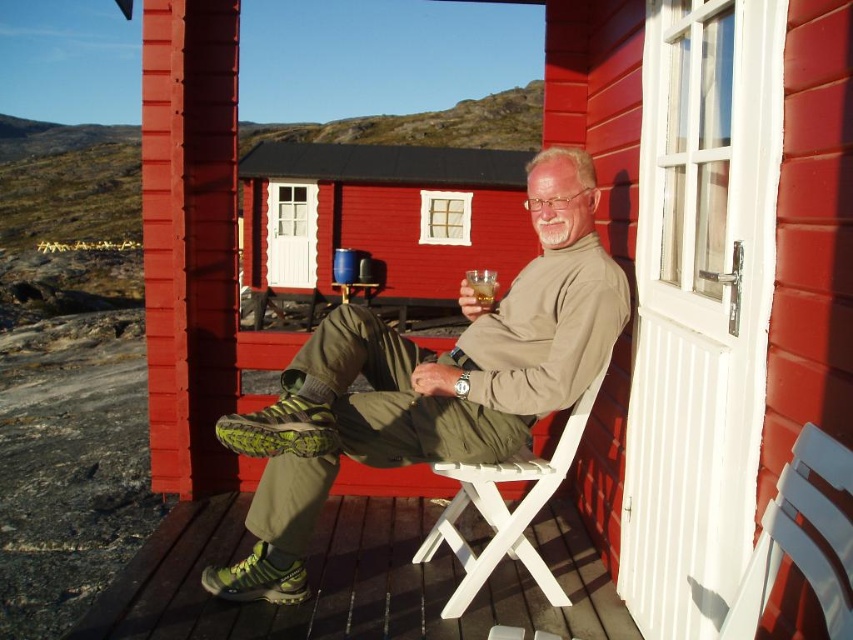
You are standing at the edge of the porch and want to walk to the point marked by point (x=485, y=438). However, there is an obstacle at point (x=262, y=202). Based on the scene description, will you encounter the obstacle before reaching your destination?

Point (x=485, y=438) is in front of point (x=262, y=202), so you will not encounter the obstacle at point (x=262, y=202) before reaching your destination.

You are standing on the porch of the red wooden cabin and want to place a small potted plant exactly at the point with coordinates point (801, 538). Where should you put the potted plant?

The point (801, 538) is on the white plastic chair at lower right, so you should place the potted plant on the white plastic chair at lower right.